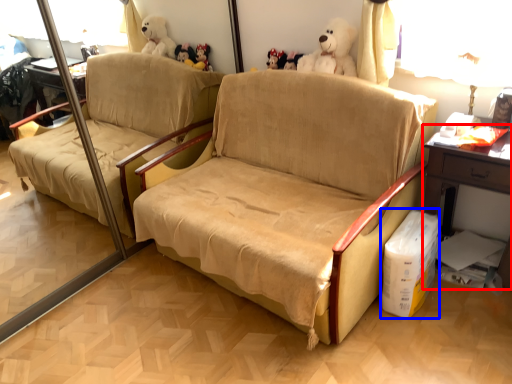
Question: Which point is further to the camera, table (highlighted by a red box) or cardboard box (highlighted by a blue box)?

Choices:
 (A) table
 (B) cardboard box

Answer: (B)